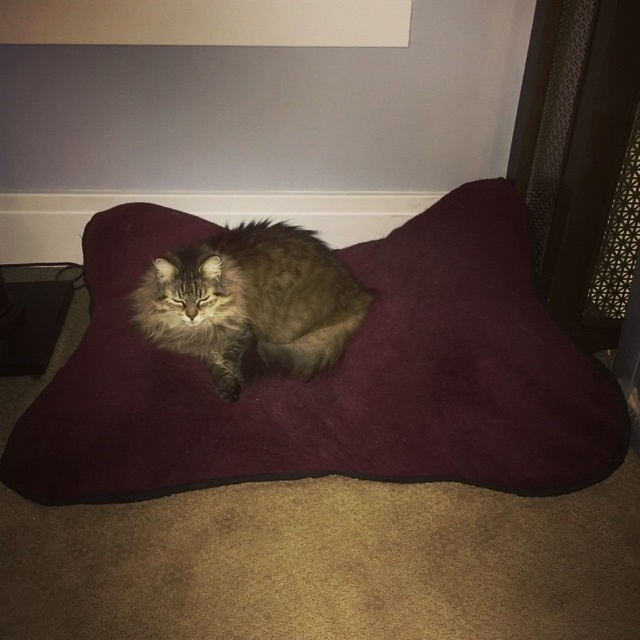
Is burgundy suede cat bed at center in front of fuzzy brown cat at center?

Yes, it is.

Which of these two, burgundy suede cat bed at center or fuzzy brown cat at center, stands taller?

Standing taller between the two is burgundy suede cat bed at center.

Is point (516, 444) closer to camera compared to point (296, 268)?

Yes, point (516, 444) is in front of point (296, 268).

Find the location of `burgundy suede cat bed at center`. burgundy suede cat bed at center is located at coordinates click(333, 376).